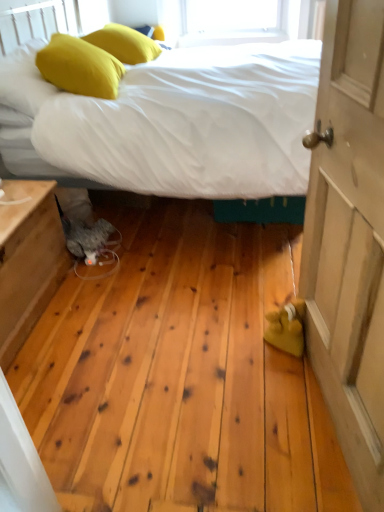
Question: Is white fabric bed at center thinner than wooden nightstand at lower left?

Choices:
 (A) yes
 (B) no

Answer: (B)

Question: From a real-world perspective, does white fabric bed at center stand above wooden nightstand at lower left?

Choices:
 (A) yes
 (B) no

Answer: (A)

Question: Is white fabric bed at center beside wooden nightstand at lower left?

Choices:
 (A) no
 (B) yes

Answer: (A)

Question: Can we say white fabric bed at center lies outside wooden nightstand at lower left?

Choices:
 (A) yes
 (B) no

Answer: (A)

Question: Is white fabric bed at center aimed at wooden nightstand at lower left?

Choices:
 (A) no
 (B) yes

Answer: (A)

Question: From the image's perspective, does white fabric bed at center appear lower than wooden nightstand at lower left?

Choices:
 (A) yes
 (B) no

Answer: (B)

Question: Does yellow fabric pillow at upper left, which appears as the 2th pillow when viewed from the back, have a larger size compared to wooden door at right?

Choices:
 (A) yes
 (B) no

Answer: (B)

Question: Considering the relative positions of yellow fabric pillow at upper left, which appears as the 2th pillow when viewed from the back, and wooden door at right in the image provided, is yellow fabric pillow at upper left, which appears as the 2th pillow when viewed from the back, in front of wooden door at right?

Choices:
 (A) no
 (B) yes

Answer: (A)

Question: Is yellow fabric pillow at upper left, which is the first pillow in front-to-back order, facing towards wooden door at right?

Choices:
 (A) no
 (B) yes

Answer: (A)

Question: From a real-world perspective, does yellow fabric pillow at upper left, placed as the 2th pillow when sorted from top to bottom, sit lower than wooden door at right?

Choices:
 (A) no
 (B) yes

Answer: (A)

Question: Is yellow fabric pillow at upper left, which ranks as the 1th pillow in bottom-to-top order, further to the viewer compared to wooden door at right?

Choices:
 (A) no
 (B) yes

Answer: (B)

Question: Is wooden door at right at the back of yellow fabric pillow at upper left, which ranks as the 1th pillow in bottom-to-top order?

Choices:
 (A) no
 (B) yes

Answer: (A)

Question: Does yellow fabric pillow at upper left, which appears as the 2th pillow when viewed from the back, have a larger size compared to white fabric bed at center?

Choices:
 (A) no
 (B) yes

Answer: (A)